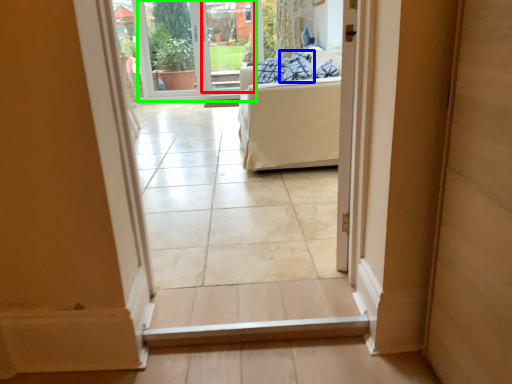
Question: Which object is positioned farthest from glass door (highlighted by a red box)? Select from pillow (highlighted by a blue box) and window screen (highlighted by a green box).

Choices:
 (A) pillow
 (B) window screen

Answer: (A)